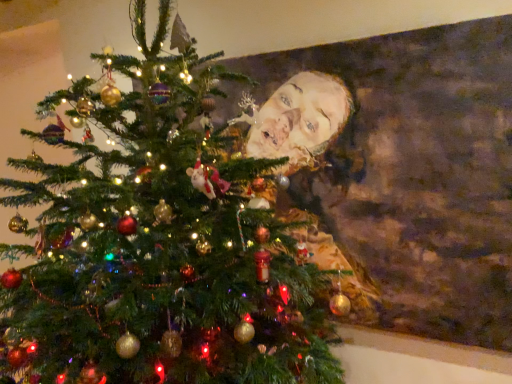
This screenshot has width=512, height=384. Identify the location of shiny metallic ornaments at center. (157, 245).

Describe the element at coordinates (157, 245) in the screenshot. The height and width of the screenshot is (384, 512). I see `shiny metallic ornaments at center` at that location.

Measure the distance between point [29,195] and camera.

Point [29,195] and camera are 1.32 meters apart from each other.

Identify the location of shiny metallic ornaments at center. This screenshot has height=384, width=512. (157, 245).